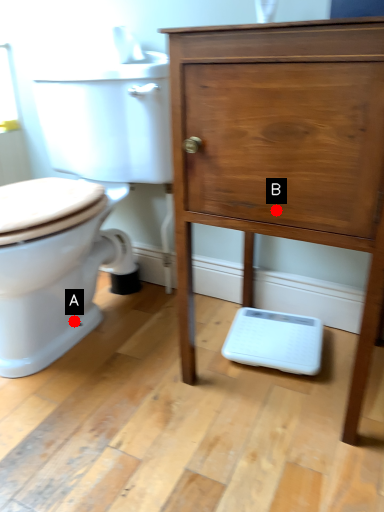
Question: Two points are circled on the image, labeled by A and B beside each circle. Among these points, which one is farthest from the camera?

Choices:
 (A) A is further
 (B) B is further

Answer: (A)